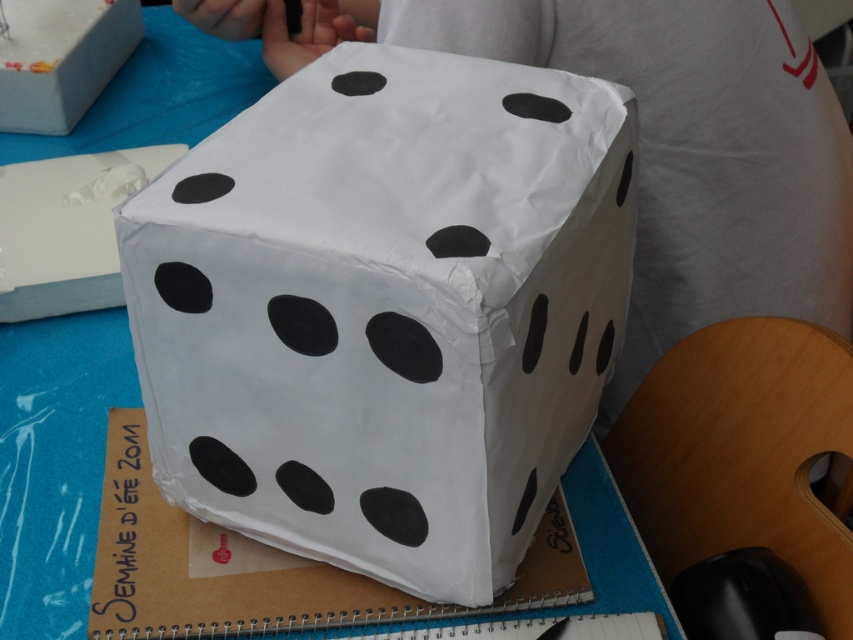
Looking at this image, what are the coordinates of the white paper dice at center?

The white paper dice at center is located at coordinates point (386,308).

You are designing a storage container for the white paper dice at center and the white paper box at upper left. Based on their heights, which object requires a taller compartment?

The white paper dice at center requires a taller compartment because it has a greater height compared to the white paper box at upper left.

You are an organizer trying to fit the white paper dice at center and the white paper box at upper left into a storage container. Based on their sizes, which object will require more space in the width dimension?

The white paper dice at center has a greater width than the white paper box at upper left, so it will require more space in the width dimension.